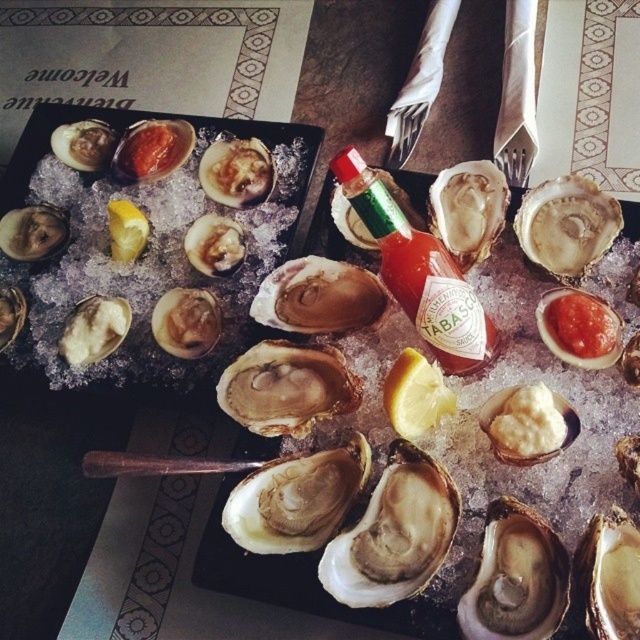
From the picture: Between white creamy mashed potato at center and yellow matte lemon at center, which one has more height?

yellow matte lemon at center

Describe the element at coordinates (525, 424) in the screenshot. Image resolution: width=640 pixels, height=640 pixels. I see `white creamy mashed potato at center` at that location.

Between point (538, 403) and point (417, 426), which one is positioned in front?

Positioned in front is point (538, 403).

Where is `white creamy mashed potato at center`? The width and height of the screenshot is (640, 640). white creamy mashed potato at center is located at coordinates (525, 424).

Who is taller, green glass tabasco sauce bottle at center or green glass tabasco bottle at center?

Standing taller between the two is green glass tabasco sauce bottle at center.

Could you measure the distance between green glass tabasco sauce bottle at center and green glass tabasco bottle at center?

The distance of green glass tabasco sauce bottle at center from green glass tabasco bottle at center is 2.69 inches.

Who is more forward, (x=371, y=188) or (x=342, y=179)?

Point (x=371, y=188) is more forward.

The height and width of the screenshot is (640, 640). Find the location of `green glass tabasco sauce bottle at center`. green glass tabasco sauce bottle at center is located at coordinates (419, 273).

Is white creamy mashed potato at center taller than red glossy tomato sauce at center?

Correct, white creamy mashed potato at center is much taller as red glossy tomato sauce at center.

Is white creamy mashed potato at center bigger than red glossy tomato sauce at center?

Incorrect, white creamy mashed potato at center is not larger than red glossy tomato sauce at center.

Is point (500, 412) less distant than point (552, 301)?

Yes, point (500, 412) is in front of point (552, 301).

You are a GUI agent. You are given a task and a screenshot of the screen. Output one action in this format:
    pyautogui.click(x=<x>, y=<y>)
    Task: Click on the white creamy mashed potato at center
    The height and width of the screenshot is (640, 640).
    Given the screenshot: What is the action you would take?
    (x=525, y=424)